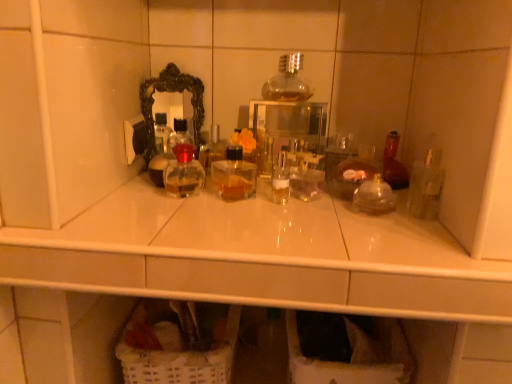
Question: In terms of height, does black ornate mirror at upper center look taller or shorter compared to clear glass bottle at center?

Choices:
 (A) tall
 (B) short

Answer: (A)

Question: From a real-world perspective, is black ornate mirror at upper center physically located above or below clear glass bottle at center?

Choices:
 (A) below
 (B) above

Answer: (B)

Question: Which is farther from the clear glass bottle at center?

Choices:
 (A) transparent glass medicine cabinet at center
 (B) black ornate mirror at upper center
 (C) white wicker laundry basket at lower center

Answer: (C)

Question: Considering the real-world distances, which object is closest to the white wicker laundry basket at lower center?

Choices:
 (A) clear glass bottle at center
 (B) transparent glass medicine cabinet at center
 (C) black ornate mirror at upper center

Answer: (B)